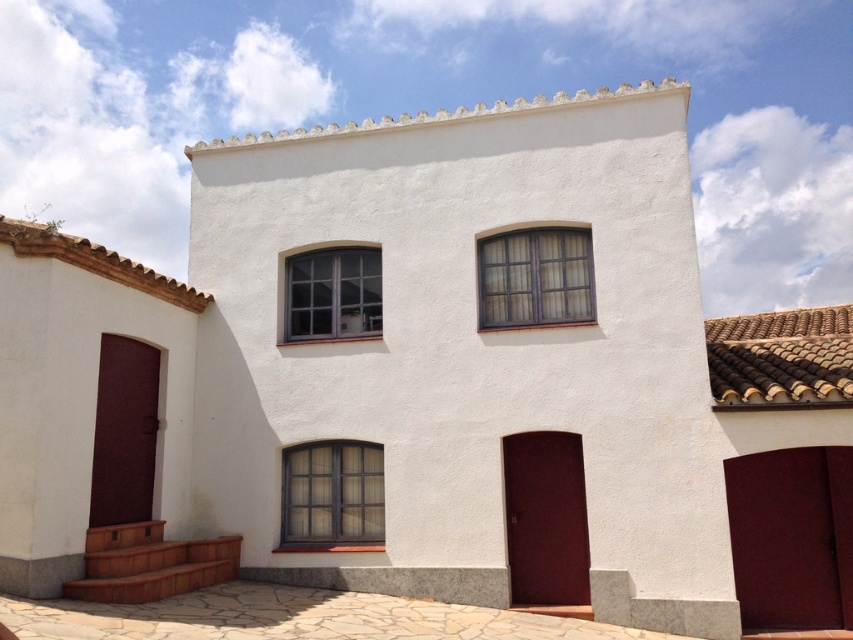
You are standing in front of the two story white building and want to know which object is nearer to you between the brown clay tiles at upper right and the matte glass window at upper center. Which one is closer?

The brown clay tiles at upper right is closer to the viewer than the matte glass window at upper center according to the description.